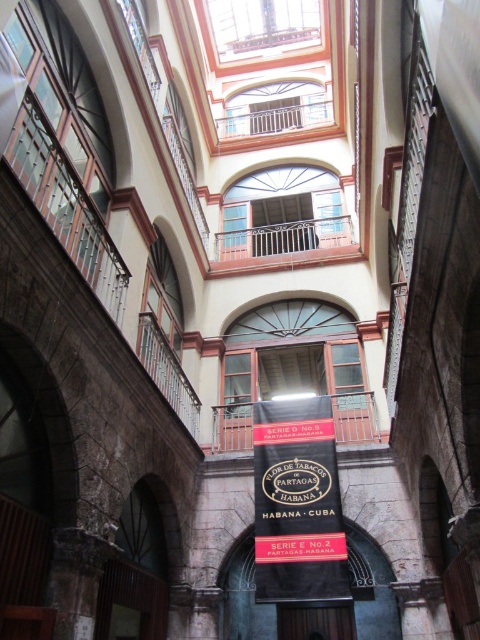
Is bronze sign at center thinner than metallic balcony at center?

No, bronze sign at center is not thinner than metallic balcony at center.

Looking at this image, does bronze sign at center have a lesser height compared to metallic balcony at center?

Incorrect, bronze sign at center's height does not fall short of metallic balcony at center's.

What do you see at coordinates (371, 588) in the screenshot? The height and width of the screenshot is (640, 480). I see `bronze sign at center` at bounding box center [371, 588].

Locate an element on the screen. bronze sign at center is located at coordinates (371, 588).

Is bronze sign at center smaller than wooden railing at upper center?

No.

You are a GUI agent. You are given a task and a screenshot of the screen. Output one action in this format:
    pyautogui.click(x=<x>, y=<y>)
    Task: Click on the bronze sign at center
    This screenshot has width=480, height=640.
    Given the screenshot: What is the action you would take?
    pyautogui.click(x=371, y=588)

Who is positioned more to the right, black fabric banner at center or wooden railing at upper center?

wooden railing at upper center

Does black fabric banner at center appear on the left side of wooden railing at upper center?

Yes, black fabric banner at center is to the left of wooden railing at upper center.

Who is more distant from viewer, (313, 540) or (248, 116)?

Positioned behind is point (248, 116).

Image resolution: width=480 pixels, height=640 pixels. I want to click on black fabric banner at center, so click(x=296, y=483).